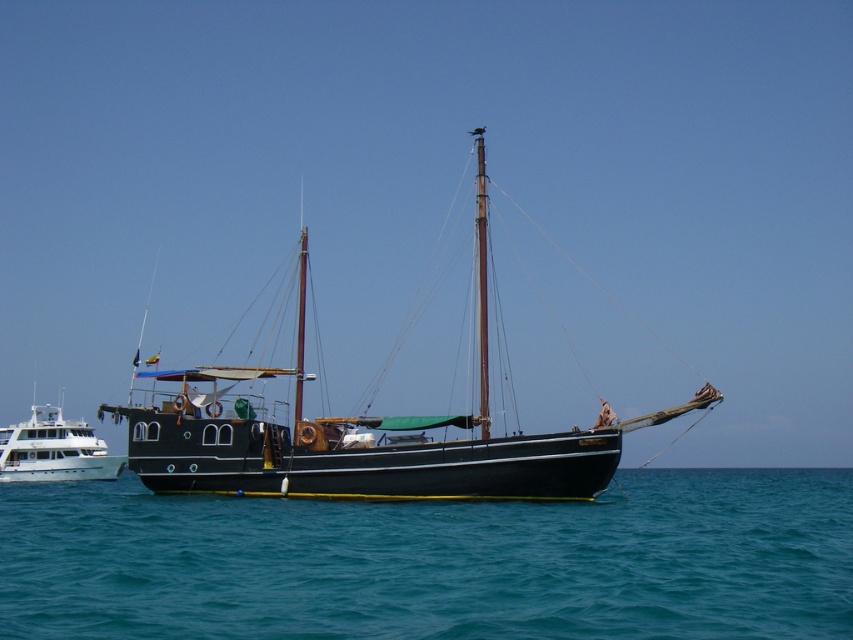
Question: Can you confirm if blue water at lower center is positioned above white glossy yacht at left?

Choices:
 (A) no
 (B) yes

Answer: (B)

Question: Based on their relative distances, which object is farther from the white glossy yacht at left?

Choices:
 (A) black polished wood sailboat at center
 (B) blue water at lower center

Answer: (A)

Question: Is blue water at lower center below white glossy yacht at left?

Choices:
 (A) no
 (B) yes

Answer: (A)

Question: Does blue water at lower center have a larger size compared to white glossy yacht at left?

Choices:
 (A) yes
 (B) no

Answer: (A)

Question: Which object is closer to the camera taking this photo?

Choices:
 (A) white glossy yacht at left
 (B) black polished wood sailboat at center
 (C) blue water at lower center

Answer: (C)

Question: Which object is the closest to the white glossy yacht at left?

Choices:
 (A) black polished wood sailboat at center
 (B) blue water at lower center

Answer: (B)